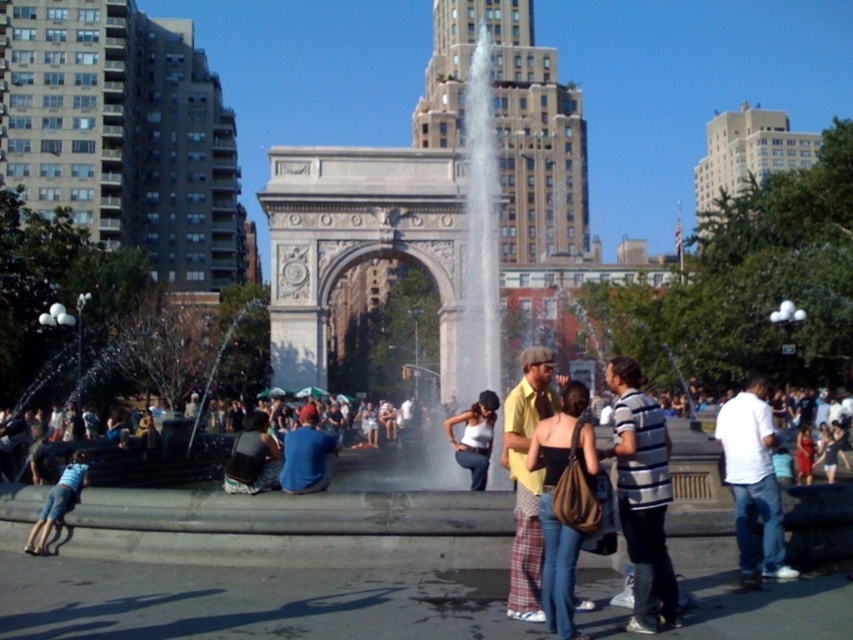
You are a photographer planning to capture a candid shot of the white cotton tank top at center and the light blue denim shorts at lower left in the plaza. Based on their sizes, which clothing item would you focus on first to ensure it fits well within your camera frame?

The white cotton tank top at center has a smaller size compared to the light blue denim shorts at lower left, so you should focus on the white cotton tank top at center first to ensure it fits well within your camera frame.

You are a photographer trying to capture the scene of the historic stone archway. You notice a person wearing a white cotton tank top at center and light blue denim shorts at lower left. Which clothing item is positioned more to the right side of the scene?

The white cotton tank top at center is positioned to the right of the light blue denim shorts at lower left, so the white cotton tank top at center is more to the right side of the scene.

You are a photographer standing in the plaza and want to take a photo of both the striped cotton shirt at center and the matte brown shoulder bag at center. Which object should you focus on first to ensure both are in focus?

The striped cotton shirt at center is further to the viewer than the matte brown shoulder bag at center, so you should focus on the striped cotton shirt at center first to ensure both are in focus.